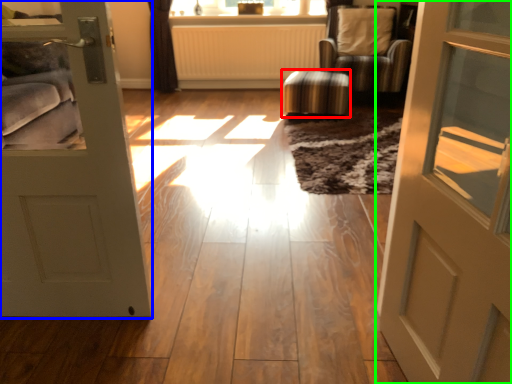
Question: Estimate the real-world distances between objects in this image. Which object is closer to stool (highlighted by a red box), door (highlighted by a blue box) or door (highlighted by a green box)?

Choices:
 (A) door
 (B) door

Answer: (A)